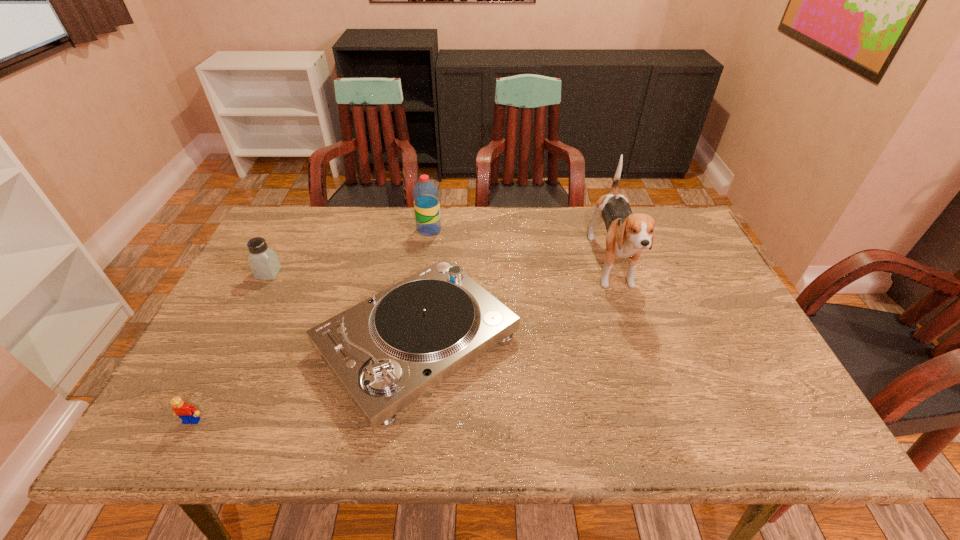
In the image, there is a desktop. At what (x,y) coordinates should I click in order to perform the action: click on vacant space at the right edge. Please return your answer as a coordinate pair (x, y). The image size is (960, 540). Looking at the image, I should click on (716, 315).

What are the coordinates of `free area in between the record player and the tallest object` in the screenshot? It's located at (515, 305).

Find the location of a particular element. This screenshot has width=960, height=540. free space that is in between the rightmost object and the water bottle is located at coordinates (520, 248).

Find the location of a particular element. This screenshot has height=540, width=960. empty space between the rightmost object and the water bottle is located at coordinates (520, 248).

Where is `blank region between the water bottle and the shortest object`? This screenshot has width=960, height=540. blank region between the water bottle and the shortest object is located at coordinates (311, 325).

This screenshot has width=960, height=540. Identify the location of empty space that is in between the record player and the shortest object. (304, 381).

Where is `free space between the record player and the saltshaker`? The height and width of the screenshot is (540, 960). free space between the record player and the saltshaker is located at coordinates (343, 308).

This screenshot has width=960, height=540. Find the location of `vacant area that lies between the puppy and the fourth shortest object`. vacant area that lies between the puppy and the fourth shortest object is located at coordinates (520, 248).

Choose which object is the second nearest neighbor to the tallest object. Please provide its 2D coordinates. Your answer should be formatted as a tuple, i.e. [(x, y)], where the tuple contains the x and y coordinates of a point satisfying the conditions above.

[(425, 193)]

This screenshot has width=960, height=540. I want to click on the second closest object to the saltshaker, so click(x=425, y=193).